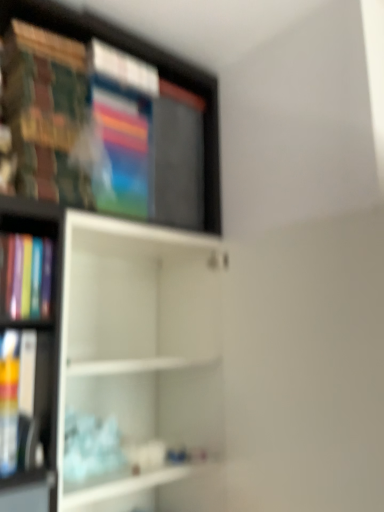
Question: From a real-world perspective, is matte plastic book at left physically located above or below white matte shelf at center, arranged as the second shelf when viewed from the top?

Choices:
 (A) below
 (B) above

Answer: (B)

Question: Choose the correct answer: Is matte plastic book at left inside white matte shelf at center, the first shelf ordered from the bottom, or outside it?

Choices:
 (A) inside
 (B) outside

Answer: (B)

Question: Estimate the real-world distances between objects in this image. Which object is closer to the white matte shelf at center, the first shelf ordered from the bottom?

Choices:
 (A) matte plastic book at left
 (B) wooden bookshelf at upper left, which is counted as the first shelf, starting from the top

Answer: (B)

Question: Considering the real-world distances, which object is farthest from the wooden bookshelf at upper left, which is counted as the first shelf, starting from the top?

Choices:
 (A) white matte shelf at center, the first shelf ordered from the bottom
 (B) matte plastic book at left

Answer: (B)